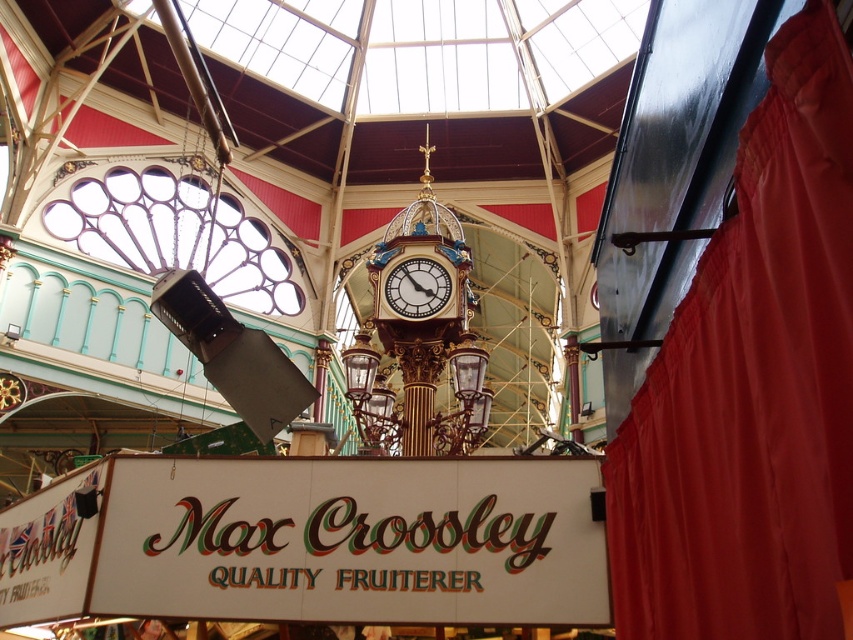
From the picture: You are a visitor standing at the entrance of the market and want to take a photo of the gold metallic clock at center. However, there is a red velvet curtain at right in the way. Can you move closer to the clock without moving the curtain?

The red velvet curtain at right is closer to the viewer than the gold metallic clock at center, so you can move closer to the clock as long as you position yourself behind the curtain to avoid blocking the view.

You are standing in the grand market and want to find the red velvet curtain at right. According to the scene description, where should you look to locate it?

The red velvet curtain at right is located at point (752, 387), so you should look towards the right side of the market near the bottom area since the coordinates suggest it is positioned at 60.5 percent from the left and 88.3 percent from the top.